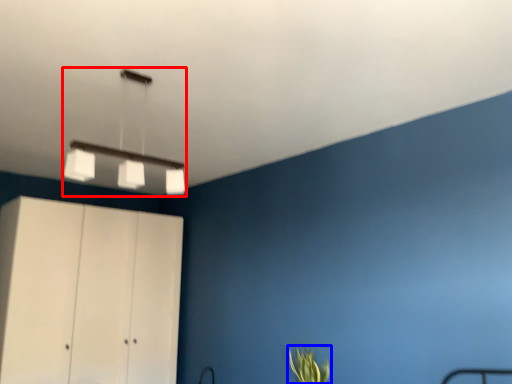
Question: Which object is closer to the camera taking this photo, lamp (highlighted by a red box) or plant (highlighted by a blue box)?

Choices:
 (A) lamp
 (B) plant

Answer: (A)